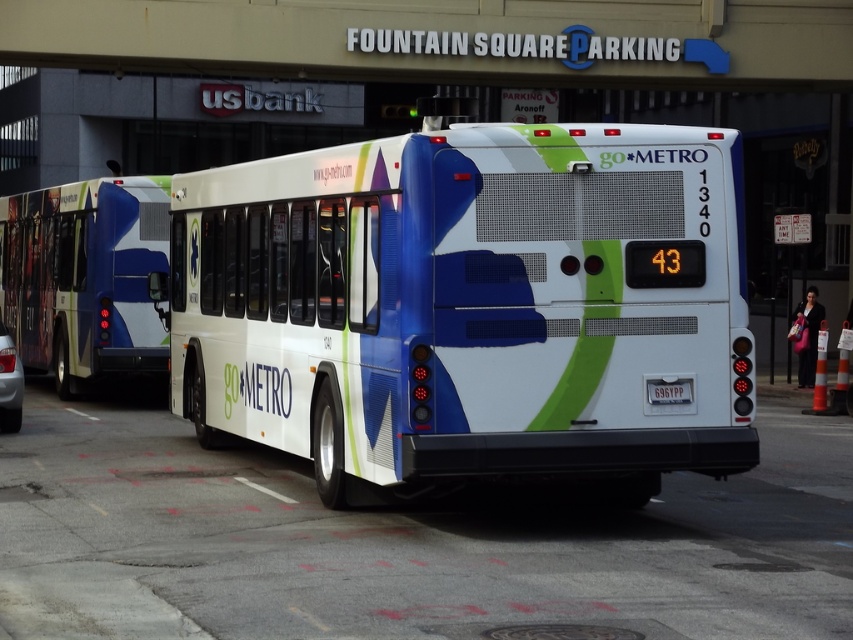
Which of these two, matte blue bus at left or metallic silver car at left, stands taller?

Standing taller between the two is matte blue bus at left.

Does point (122, 333) lie behind point (0, 364)?

Yes, it is.

Is point (55, 266) positioned behind point (10, 360)?

Yes, it is behind point (10, 360).

Locate an element on the screen. This screenshot has height=640, width=853. matte blue bus at left is located at coordinates (84, 276).

What do you see at coordinates (84, 276) in the screenshot? I see `matte blue bus at left` at bounding box center [84, 276].

Does matte blue bus at left appear on the right side of black plastic license plate at center?

Incorrect, matte blue bus at left is not on the right side of black plastic license plate at center.

Locate an element on the screen. matte blue bus at left is located at coordinates (84, 276).

Is point (685, 374) behind point (51, 292)?

No, it is in front of (51, 292).

Can you confirm if white glossy bus at center is thinner than matte blue bus at left?

Correct, white glossy bus at center's width is less than matte blue bus at left's.

Between point (372, 240) and point (91, 234), which one is positioned in front?

Point (372, 240) is more forward.

The width and height of the screenshot is (853, 640). In order to click on white glossy bus at center in this screenshot , I will do `click(471, 305)`.